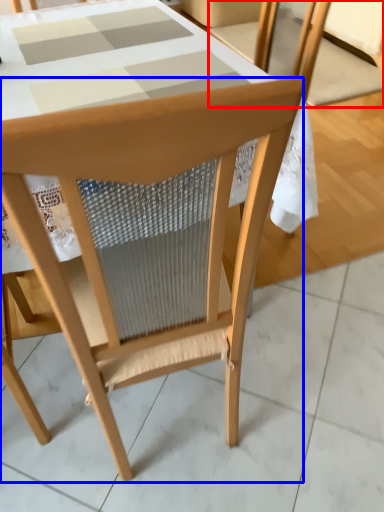
Question: Which object appears farthest to the camera in this image, chair (highlighted by a red box) or chair (highlighted by a blue box)?

Choices:
 (A) chair
 (B) chair

Answer: (A)